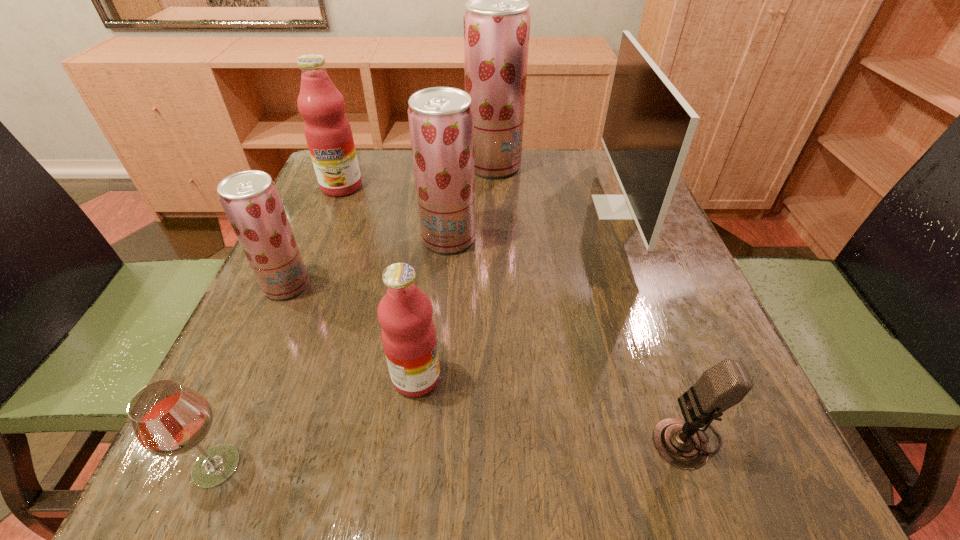
Find the location of `the farthest strawberry fruit juice`. the farthest strawberry fruit juice is located at coordinates (496, 21).

Locate an element on the screen. This screenshot has width=960, height=540. the biggest strawberry fruit juice is located at coordinates (496, 21).

This screenshot has width=960, height=540. Identify the location of monitor. (649, 126).

Where is `the third farthest fruit juice`? The height and width of the screenshot is (540, 960). the third farthest fruit juice is located at coordinates tap(441, 119).

I want to click on the second smallest strawberry fruit juice, so click(441, 119).

This screenshot has width=960, height=540. I want to click on the farther pink fruit juice, so click(x=328, y=133).

You are a GUI agent. You are given a task and a screenshot of the screen. Output one action in this format:
    pyautogui.click(x=<x>, y=<y>)
    Task: Click on the bigger pink fruit juice
    
    Given the screenshot: What is the action you would take?
    pyautogui.click(x=328, y=133)

At what (x,y) coordinates should I click in order to perform the action: click on the leftmost strawberry fruit juice. Please return your answer as a coordinate pair (x, y). Looking at the image, I should click on (250, 199).

You are a GUI agent. You are given a task and a screenshot of the screen. Output one action in this format:
    pyautogui.click(x=<x>, y=<y>)
    Task: Click on the smallest strawberry fruit juice
    Image resolution: width=960 pixels, height=540 pixels.
    Given the screenshot: What is the action you would take?
    [x=250, y=199]

Where is `the right pink fruit juice`? Image resolution: width=960 pixels, height=540 pixels. the right pink fruit juice is located at coordinates (404, 313).